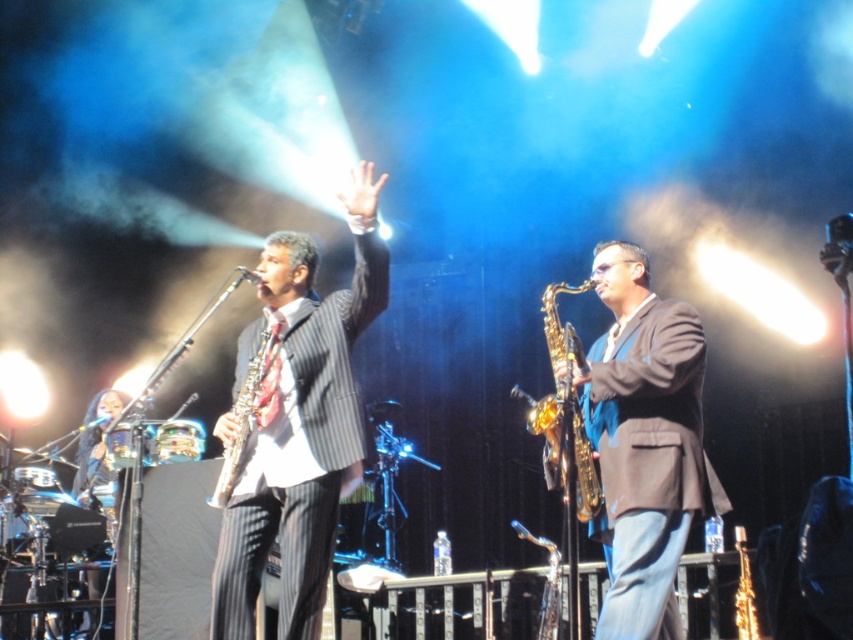
Who is positioned more to the right, pinstripe suit at center or shiny gold saxophone at center?

Positioned to the right is shiny gold saxophone at center.

Can you confirm if pinstripe suit at center is positioned to the left of shiny gold saxophone at center?

Yes, pinstripe suit at center is to the left of shiny gold saxophone at center.

Where is `pinstripe suit at center`? pinstripe suit at center is located at coordinates (299, 426).

Is pinstripe suit at center in front of silver metallic saxophone at center?

Yes, pinstripe suit at center is closer to the viewer.

Which is behind, point (318, 433) or point (260, 413)?

The point (260, 413) is more distant.

Locate an element on the screen. pinstripe suit at center is located at coordinates (299, 426).

Which is more to the left, gold shiny saxophone at center or silver metallic saxophone at center?

Positioned to the left is silver metallic saxophone at center.

Between gold shiny saxophone at center and silver metallic saxophone at center, which one appears on the right side from the viewer's perspective?

From the viewer's perspective, gold shiny saxophone at center appears more on the right side.

The height and width of the screenshot is (640, 853). What do you see at coordinates (564, 445) in the screenshot?
I see `gold shiny saxophone at center` at bounding box center [564, 445].

I want to click on gold shiny saxophone at center, so click(564, 445).